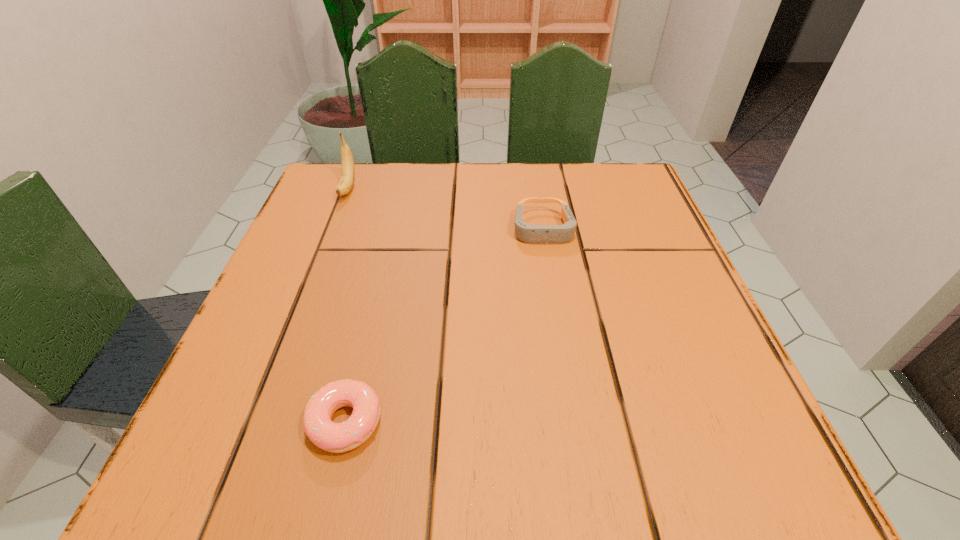
This screenshot has height=540, width=960. I want to click on the farthest object, so click(345, 184).

Identify the location of banana. (345, 184).

Find the location of `the second farthest object`. the second farthest object is located at coordinates (536, 234).

Where is `the rightmost object`? the rightmost object is located at coordinates (536, 234).

Locate an element on the screen. The height and width of the screenshot is (540, 960). doughnut is located at coordinates pos(333,437).

In order to click on the second object from right to left in this screenshot , I will do `click(333, 437)`.

You are a GUI agent. You are given a task and a screenshot of the screen. Output one action in this format:
    pyautogui.click(x=<x>, y=<y>)
    Task: Click on the vacant area situated 0.330m at the start of the peel on the tallest object
    The image size is (960, 540).
    Given the screenshot: What is the action you would take?
    pyautogui.click(x=296, y=322)

The height and width of the screenshot is (540, 960). What are the coordinates of `vacant area situated on the front and back of the rightmost object` in the screenshot? It's located at (555, 301).

Where is `vacant space located on the back of the nearest object`? This screenshot has height=540, width=960. vacant space located on the back of the nearest object is located at coordinates (372, 305).

This screenshot has height=540, width=960. I want to click on banana present at the far edge, so click(345, 184).